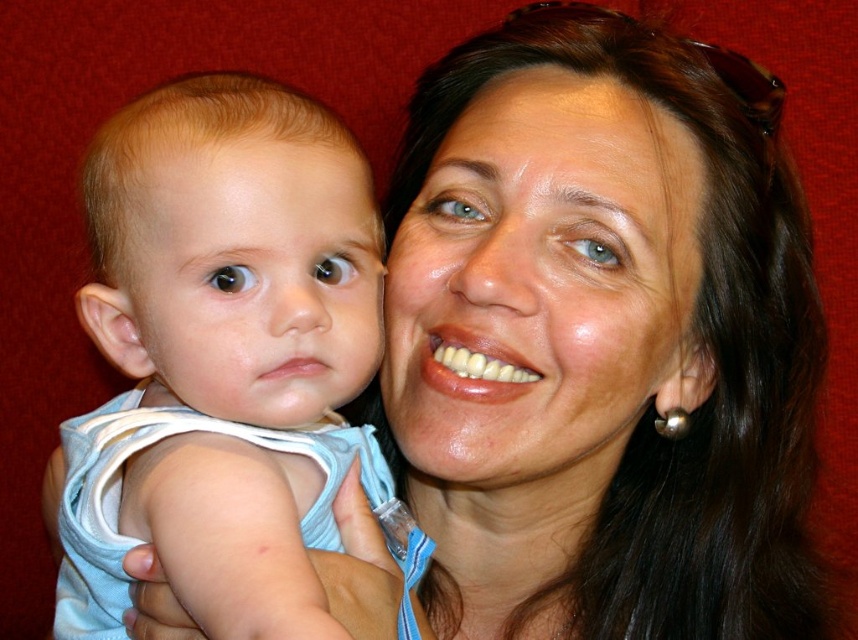
Question: Does light blue fabric baby at left have a larger size compared to smooth skin face at center?

Choices:
 (A) no
 (B) yes

Answer: (B)

Question: Does light blue fabric baby at left have a lesser width compared to smooth skin baby at center?

Choices:
 (A) yes
 (B) no

Answer: (B)

Question: Which object appears closest to the camera in this image?

Choices:
 (A) light blue fabric baby at left
 (B) smooth skin face at center

Answer: (A)

Question: Is light blue fabric baby at left smaller than smooth skin face at center?

Choices:
 (A) yes
 (B) no

Answer: (B)

Question: Which point is farther to the camera?

Choices:
 (A) (251, 276)
 (B) (195, 294)

Answer: (B)

Question: Which is farther from the smooth skin baby at center?

Choices:
 (A) smooth skin face at center
 (B) light blue fabric baby at left

Answer: (A)